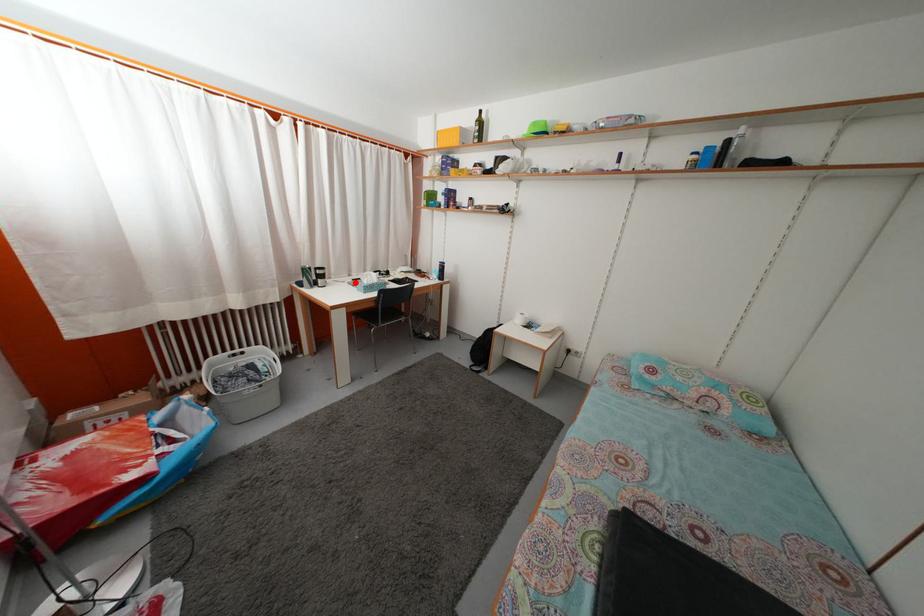
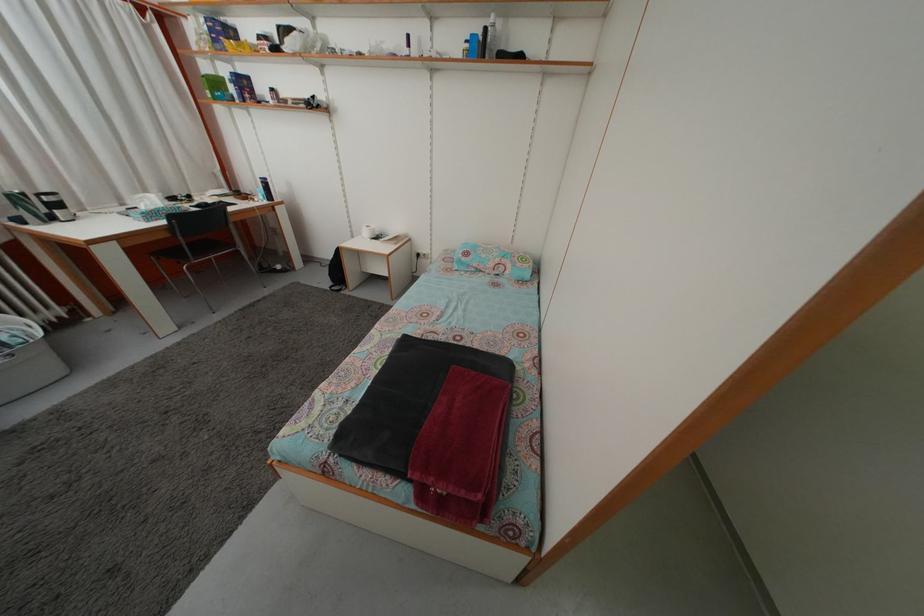
In the second image, find the point that corresponds to the highlighted location in the first image.

(128, 213)